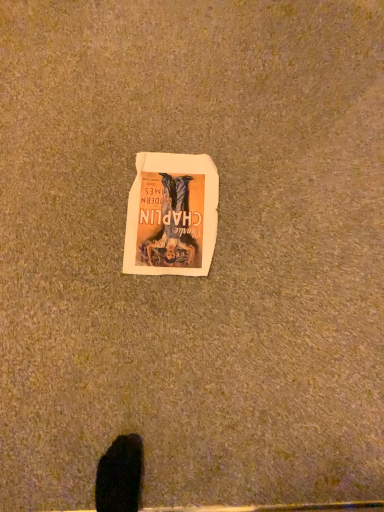
The height and width of the screenshot is (512, 384). Identify the location of vacant space positioned to the left of matte paper poster at center. (69, 197).